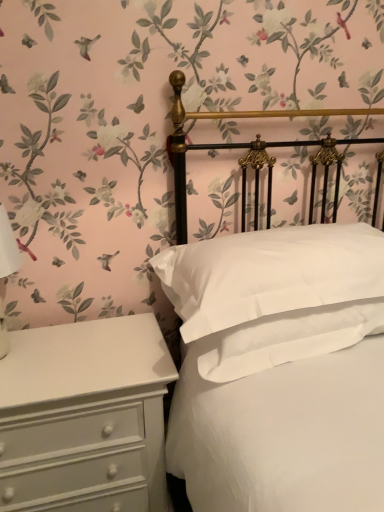
Question: From the image's perspective, is white painted wood chest of drawers at lower left under white smooth pillow at center?

Choices:
 (A) no
 (B) yes

Answer: (B)

Question: Is white painted wood chest of drawers at lower left behind white smooth pillow at center?

Choices:
 (A) no
 (B) yes

Answer: (B)

Question: Is white painted wood chest of drawers at lower left wider than white smooth pillow at center?

Choices:
 (A) yes
 (B) no

Answer: (B)

Question: Is white painted wood chest of drawers at lower left far away from white smooth pillow at center?

Choices:
 (A) no
 (B) yes

Answer: (A)

Question: Considering the relative sizes of white painted wood chest of drawers at lower left and white smooth pillow at center in the image provided, is white painted wood chest of drawers at lower left shorter than white smooth pillow at center?

Choices:
 (A) no
 (B) yes

Answer: (A)

Question: Based on their positions, is white painted wood chest of drawers at lower left located to the left or right of white matte bed at center?

Choices:
 (A) right
 (B) left

Answer: (B)

Question: From the image's perspective, relative to white matte bed at center, is white painted wood chest of drawers at lower left above or below?

Choices:
 (A) below
 (B) above

Answer: (A)

Question: Considering their positions, is white painted wood chest of drawers at lower left located in front of or behind white matte bed at center?

Choices:
 (A) front
 (B) behind

Answer: (B)

Question: Would you say white painted wood chest of drawers at lower left is inside or outside white matte bed at center?

Choices:
 (A) outside
 (B) inside

Answer: (A)

Question: Looking at their shapes, would you say white smooth pillow at center is wider or thinner than white matte bed at center?

Choices:
 (A) wide
 (B) thin

Answer: (B)

Question: Relative to white matte bed at center, is white smooth pillow at center in front or behind?

Choices:
 (A) behind
 (B) front

Answer: (A)

Question: Considering the relative positions of white smooth pillow at center and white matte bed at center in the image provided, is white smooth pillow at center to the left or to the right of white matte bed at center?

Choices:
 (A) right
 (B) left

Answer: (B)

Question: Is white smooth pillow at center bigger or smaller than white matte bed at center?

Choices:
 (A) big
 (B) small

Answer: (B)

Question: Considering the positions of white matte bed at center and white smooth pillow at center in the image, is white matte bed at center taller or shorter than white smooth pillow at center?

Choices:
 (A) short
 (B) tall

Answer: (B)

Question: Is point (180, 134) positioned closer to the camera than point (172, 276)?

Choices:
 (A) farther
 (B) closer

Answer: (A)